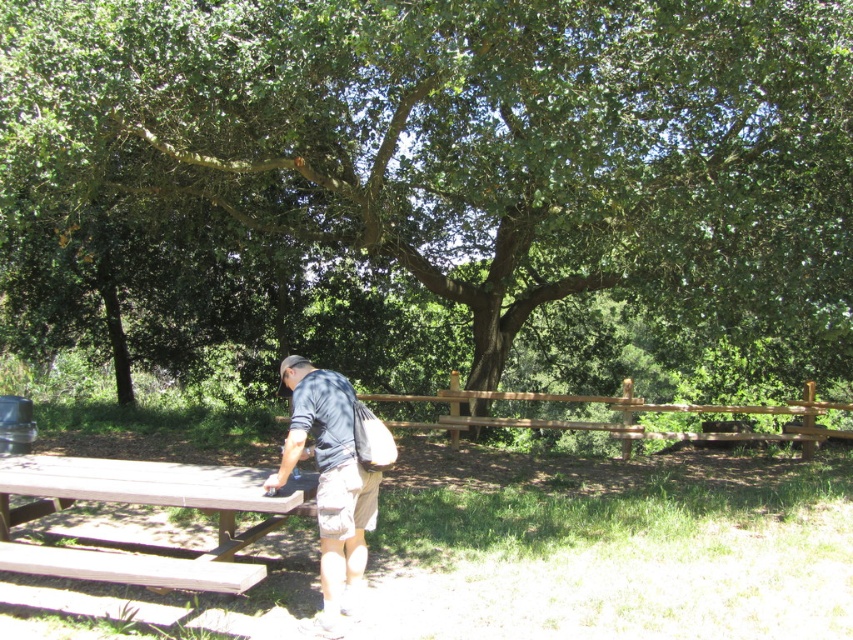
Between brown wood picnic table at lower left and dark blue shirt at center, which one appears on the left side from the viewer's perspective?

Positioned to the left is brown wood picnic table at lower left.

Is the position of brown wood picnic table at lower left more distant than that of dark blue shirt at center?

No, brown wood picnic table at lower left is in front of dark blue shirt at center.

What are the coordinates of `brown wood picnic table at lower left` in the screenshot? It's located at (142, 502).

Does green leafy tree at center appear under dark blue shirt at center?

No.

Where is `green leafy tree at center`? The height and width of the screenshot is (640, 853). green leafy tree at center is located at coordinates (434, 189).

Does green leafy tree at center have a smaller size compared to brown wood picnic table at lower left?

No, green leafy tree at center is not smaller than brown wood picnic table at lower left.

Between green leafy tree at center and brown wood picnic table at lower left, which one appears on the left side from the viewer's perspective?

Positioned to the left is brown wood picnic table at lower left.

You are a GUI agent. You are given a task and a screenshot of the screen. Output one action in this format:
    pyautogui.click(x=<x>, y=<y>)
    Task: Click on the green leafy tree at center
    This screenshot has width=853, height=640.
    Given the screenshot: What is the action you would take?
    pyautogui.click(x=434, y=189)